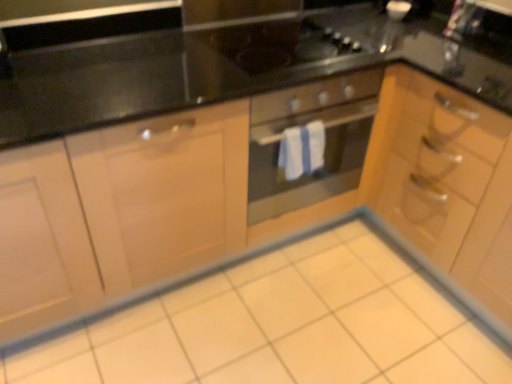
Question: From a real-world perspective, is black glass gas stove at center above or below white glossy tile at center?

Choices:
 (A) below
 (B) above

Answer: (B)

Question: Is black glass gas stove at center to the left or to the right of white glossy tile at center in the image?

Choices:
 (A) right
 (B) left

Answer: (A)

Question: Estimate the real-world distances between objects in this image. Which object is farther from the wooden cabinet at right?

Choices:
 (A) stainless steel oven at center
 (B) white glossy tile at center
 (C) black glass gas stove at center

Answer: (B)

Question: Which is nearer to the wooden cabinet at right?

Choices:
 (A) white glossy tile at center
 (B) stainless steel oven at center
 (C) black glass gas stove at center

Answer: (B)